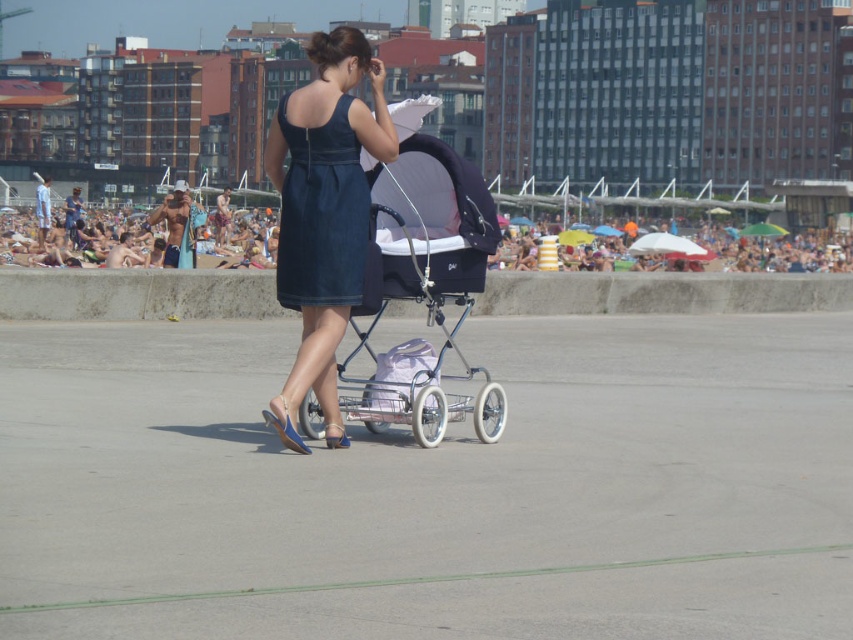
You are standing on the beach and see the matte black baby carriage at center and the dark denim dress at center. Which object is positioned lower in the image?

The matte black baby carriage at center is located below the dark denim dress at center, so it is positioned lower in the image.

Where is the denim dress at center located in the image?

The denim dress at center is located at point (323, 216).

You are a photographer trying to capture a clear shot of the matte black baby carriage at center and the multicolored umbrellas at upper center. Considering their sizes, which object will appear larger in your photo?

The multicolored umbrellas at upper center will appear larger in the photo because they are bigger in size than the matte black baby carriage at center.